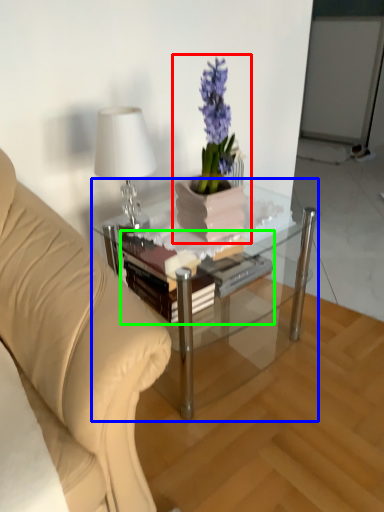
Question: Which object is positioned closest to houseplant (highlighted by a red box)? Select from coffee table (highlighted by a blue box) and book (highlighted by a green box).

Choices:
 (A) coffee table
 (B) book

Answer: (B)